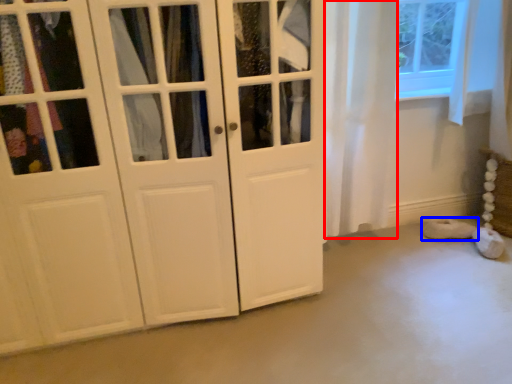
Question: Among these objects, which one is nearest to the camera, curtain (highlighted by a red box) or footwear (highlighted by a blue box)?

Choices:
 (A) curtain
 (B) footwear

Answer: (A)